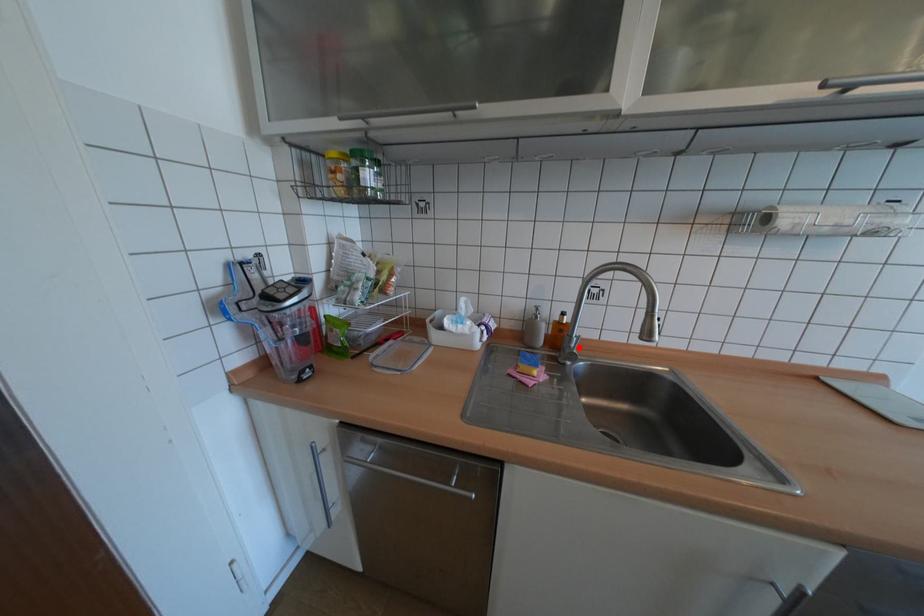
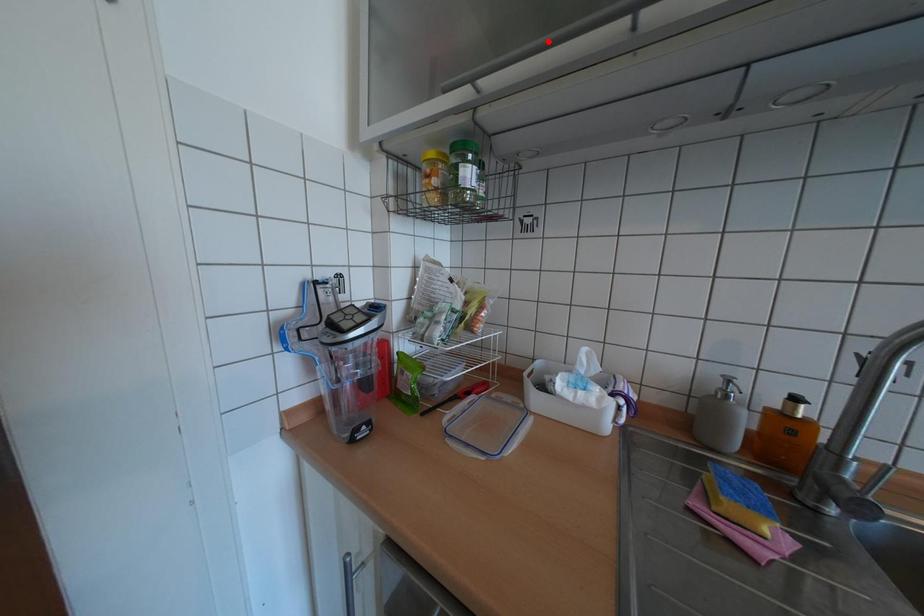
I am providing you with two images of the same scene from different viewpoints. A red point is marked on the first image and another point is marked on the second image. Do the highlighted points in image1 and image2 indicate the same real-world spot?

No